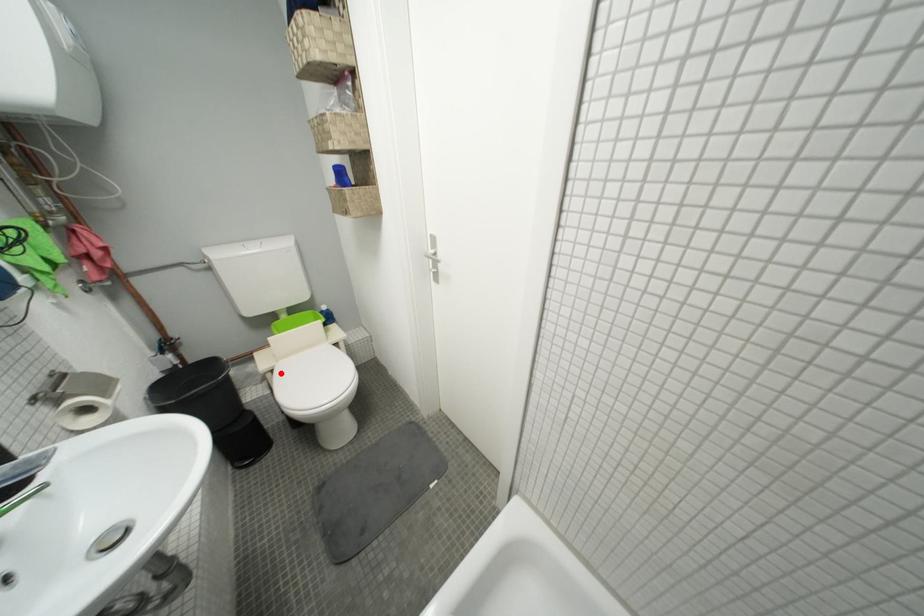
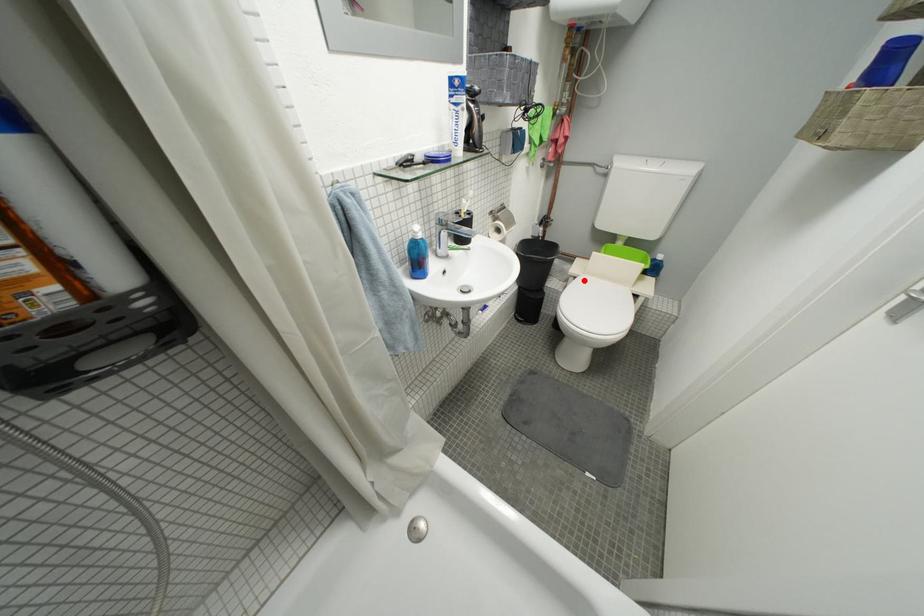
I am providing you with two images of the same scene from different viewpoints. A red point is marked on the first image and another point is marked on the second image. Is the marked point in image1 the same physical position as the marked point in image2?

Yes